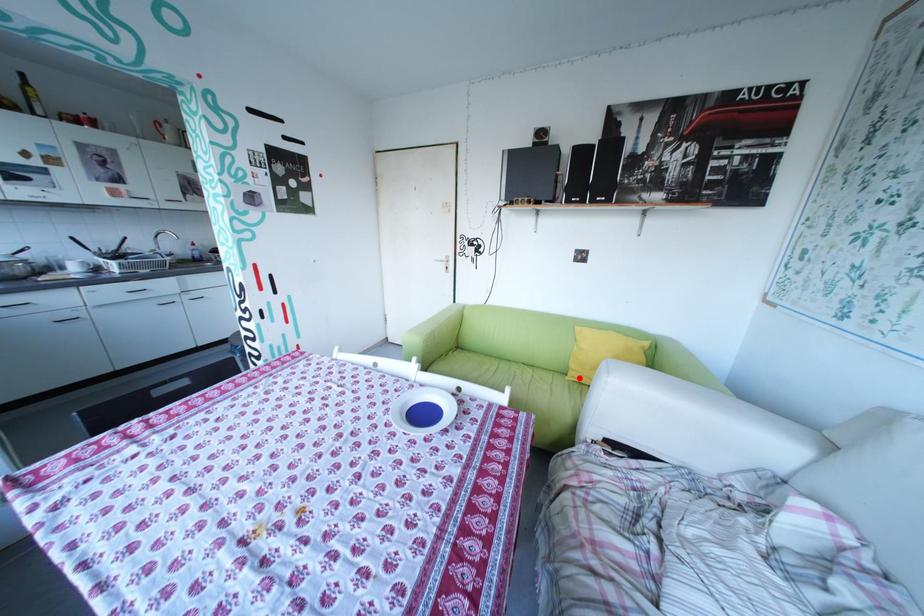
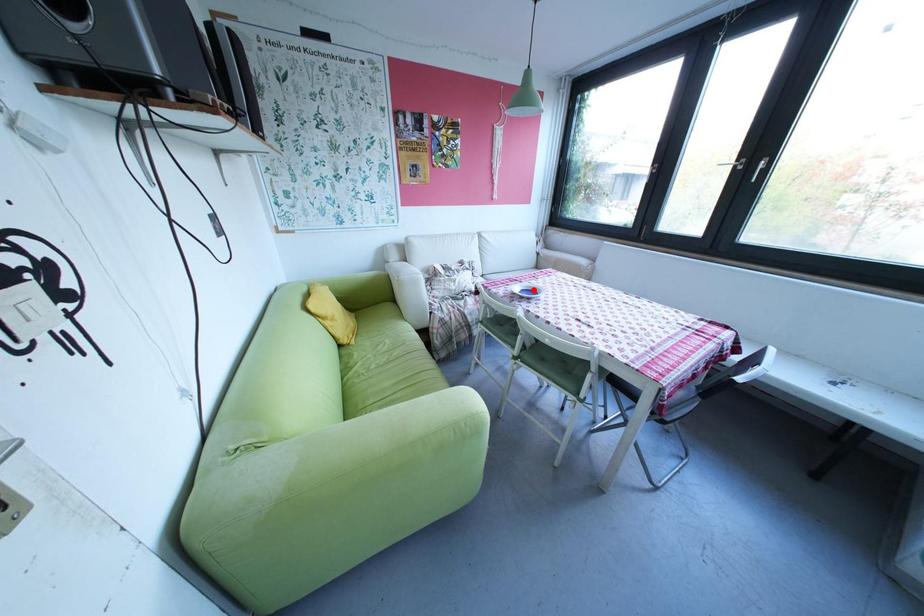
I am providing you with two images of the same scene from different viewpoints. A red point is marked on the first image and another point is marked on the second image. Is the marked point in image1 the same physical position as the marked point in image2?

No